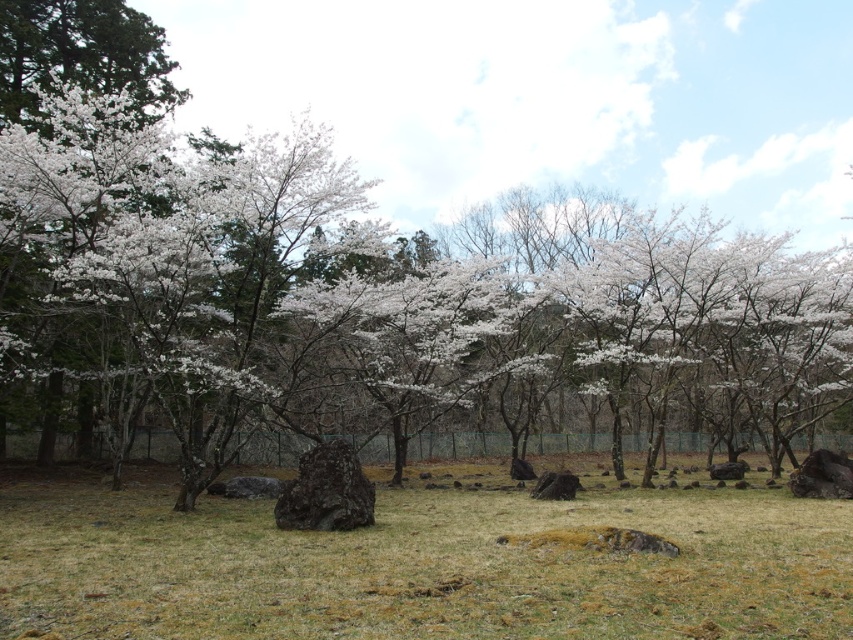
Question: Among these objects, which one is nearest to the camera?

Choices:
 (A) white blossoms at center
 (B) brown grass at center

Answer: (B)

Question: Is brown grass at center wider than white blossoms at center?

Choices:
 (A) yes
 (B) no

Answer: (B)

Question: Is brown grass at center above white blossoms at center?

Choices:
 (A) yes
 (B) no

Answer: (B)

Question: Considering the relative positions of brown grass at center and white blossoms at center in the image provided, where is brown grass at center located with respect to white blossoms at center?

Choices:
 (A) right
 (B) left

Answer: (A)